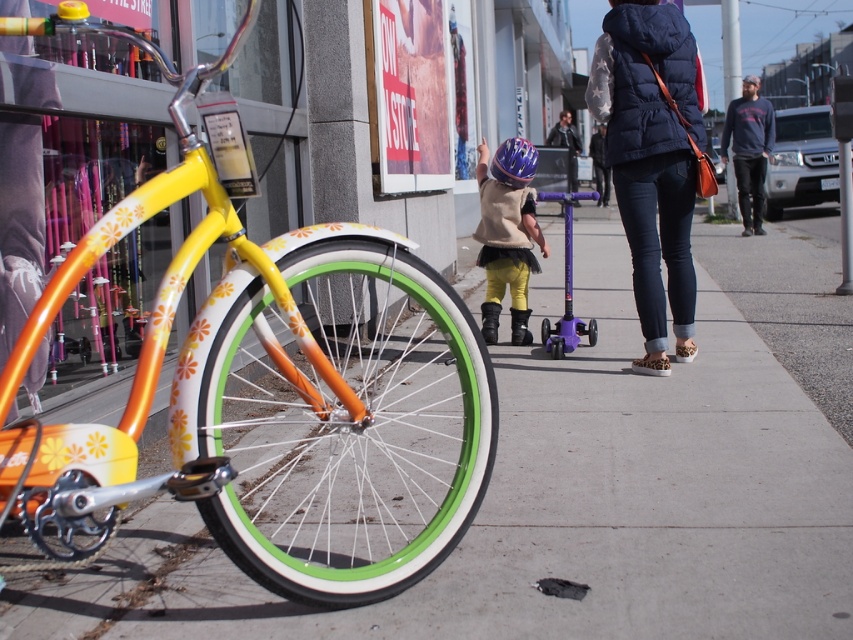
I want to click on dark blue puffer vest at center, so click(x=651, y=161).

Between point (604, 109) and point (509, 147), which one is positioned in front?

Point (604, 109) is in front.

Is point (683, 136) closer to viewer compared to point (512, 145)?

Yes, it is.

Identify the location of dark blue puffer vest at center. The height and width of the screenshot is (640, 853). (651, 161).

Can you confirm if concrete sidewalk at center is wider than shiny purple helmet at center?

Yes.

Does concrete sidewalk at center appear under shiny purple helmet at center?

Correct, concrete sidewalk at center is located below shiny purple helmet at center.

The width and height of the screenshot is (853, 640). Describe the element at coordinates (582, 483) in the screenshot. I see `concrete sidewalk at center` at that location.

What are the coordinates of `concrete sidewalk at center` in the screenshot? It's located at (582, 483).

Can you confirm if dark blue puffer vest at center is positioned above dark blue puffer jacket at center?

Actually, dark blue puffer vest at center is below dark blue puffer jacket at center.

Is point (688, 289) farther from camera compared to point (566, 145)?

No, (688, 289) is closer to viewer.

You are a GUI agent. You are given a task and a screenshot of the screen. Output one action in this format:
    pyautogui.click(x=<x>, y=<y>)
    Task: Click on the dark blue puffer vest at center
    The height and width of the screenshot is (640, 853).
    Given the screenshot: What is the action you would take?
    pyautogui.click(x=651, y=161)

Where is `dark blue puffer vest at center`? Image resolution: width=853 pixels, height=640 pixels. dark blue puffer vest at center is located at coordinates (651, 161).